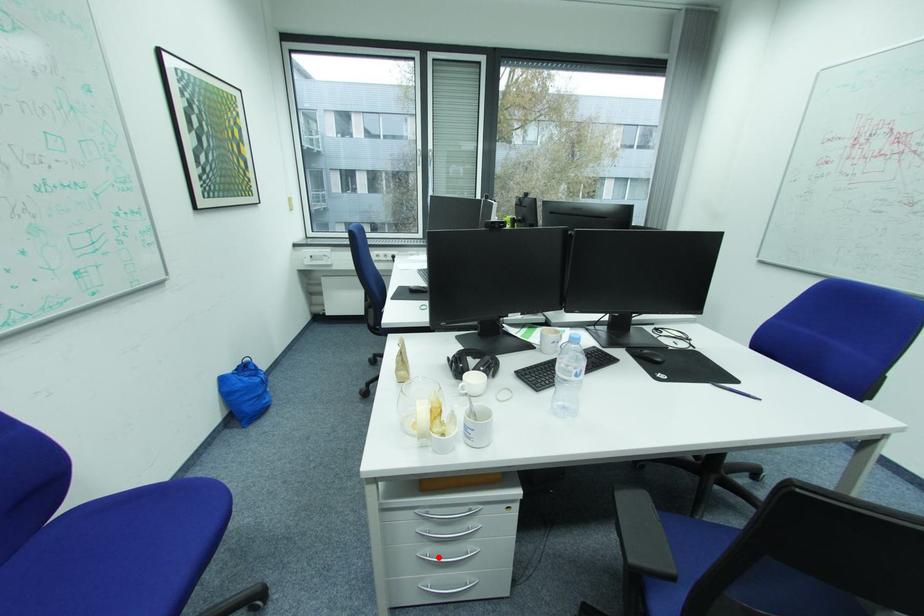
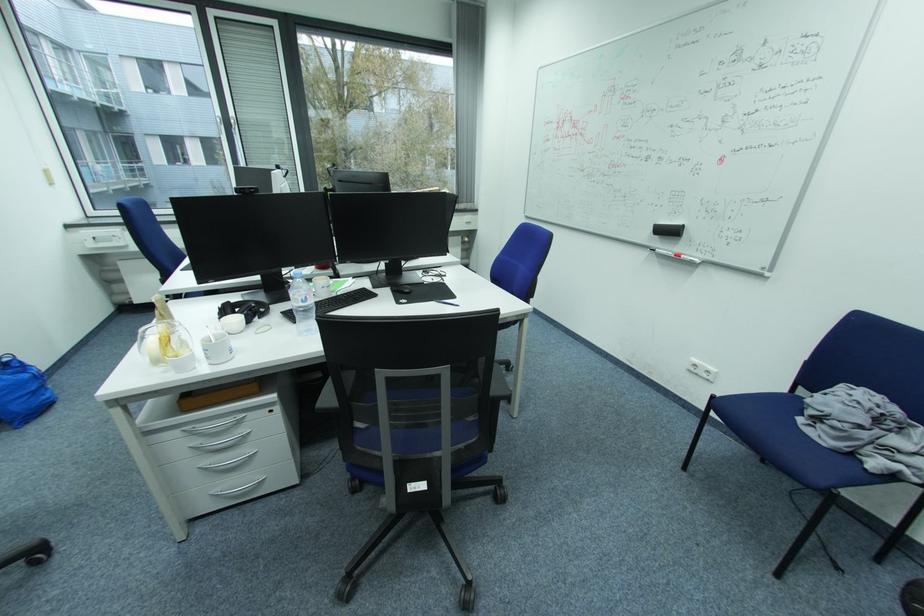
Question: I am providing you with two images of the same scene from different viewpoints. A red point is shown in image1. For the corresponding object point in image2, is it positioned nearer or farther from the camera?

Choices:
 (A) Nearer
 (B) Farther

Answer: (A)